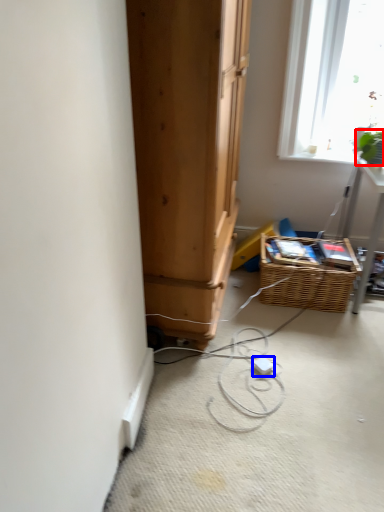
Question: Which of the following is the closest to the observer, plant (highlighted by a red box) or extension cord (highlighted by a blue box)?

Choices:
 (A) plant
 (B) extension cord

Answer: (B)